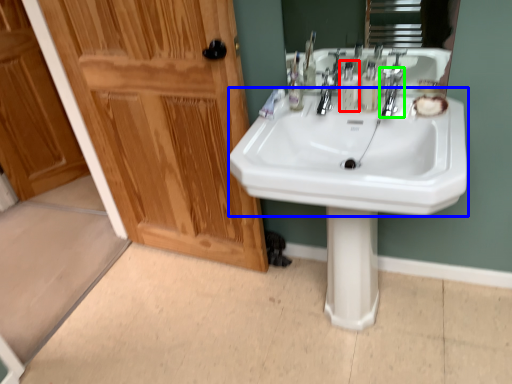
Question: Considering the real-world distances, which object is closest to mouthwash (highlighted by a red box)? sink (highlighted by a blue box) or tap (highlighted by a green box).

Choices:
 (A) sink
 (B) tap

Answer: (B)